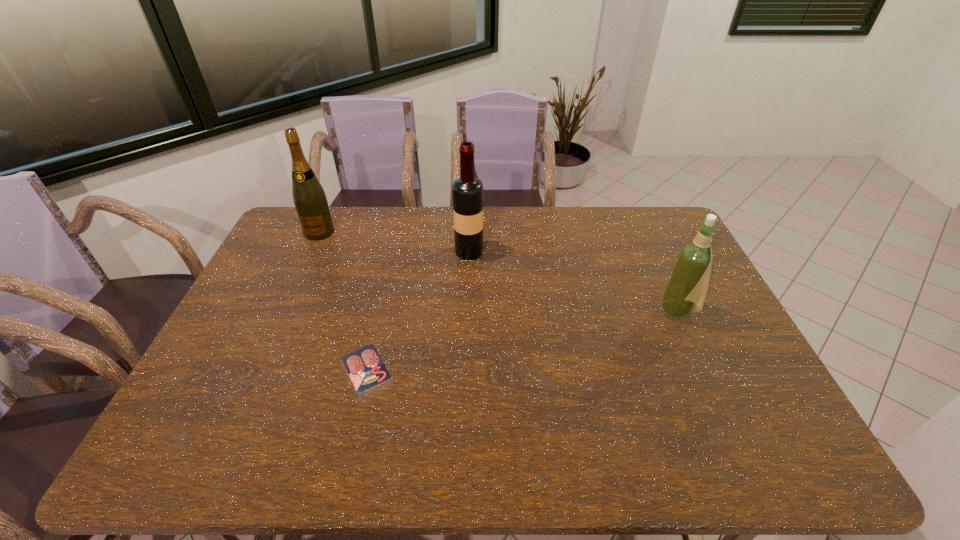
What are the coordinates of `free location located 0.130m on the front-facing side of the second shortest object` in the screenshot? It's located at (616, 312).

I want to click on free space located 0.200m on the front-facing side of the second shortest object, so click(x=592, y=312).

I want to click on vacant space located 0.130m on the front-facing side of the second shortest object, so click(x=616, y=312).

Locate an element on the screen. free space located 0.330m on the back of the salami is located at coordinates (389, 267).

Identify the location of object that is positioned at the left edge. The width and height of the screenshot is (960, 540). (310, 201).

Image resolution: width=960 pixels, height=540 pixels. Find the location of `object that is at the right edge`. object that is at the right edge is located at coordinates (688, 284).

I want to click on object present at the far left corner, so click(310, 201).

The image size is (960, 540). What are the coordinates of `free space at the far edge` in the screenshot? It's located at (592, 214).

Identify the location of vacant space at the left edge of the desktop. The height and width of the screenshot is (540, 960). (240, 320).

I want to click on vacant space at the right edge of the desktop, so click(648, 247).